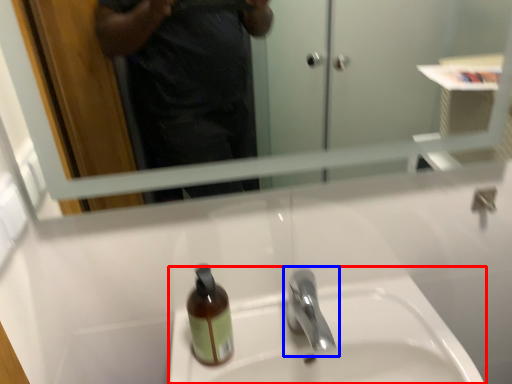
Question: Which of the following is the farthest to the observer, sink (highlighted by a red box) or tap (highlighted by a blue box)?

Choices:
 (A) sink
 (B) tap

Answer: (A)